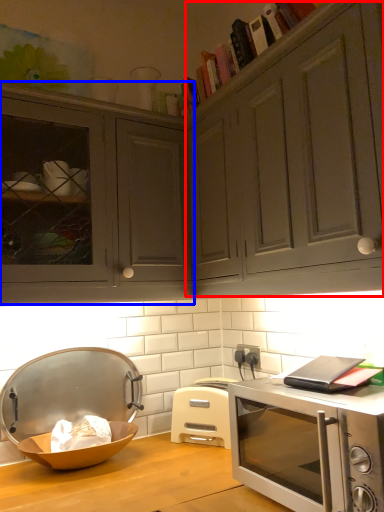
Question: Which object appears farthest to the camera in this image, drawer (highlighted by a red box) or cabinetry (highlighted by a blue box)?

Choices:
 (A) drawer
 (B) cabinetry

Answer: (B)